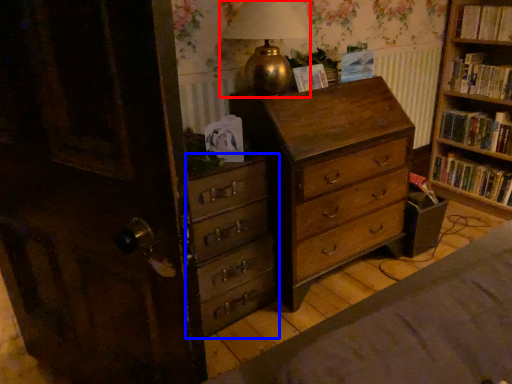
Question: Which of the following is the farthest to the observer, table lamp (highlighted by a red box) or chest of drawers (highlighted by a blue box)?

Choices:
 (A) table lamp
 (B) chest of drawers

Answer: (B)